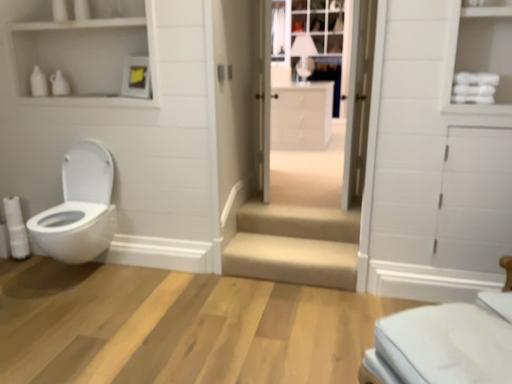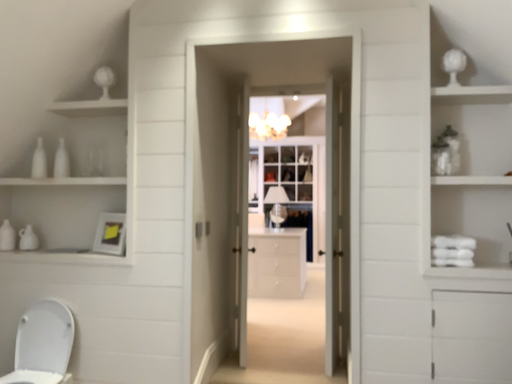
Question: Which way did the camera rotate in the video?

Choices:
 (A) rotated upward
 (B) rotated downward

Answer: (A)